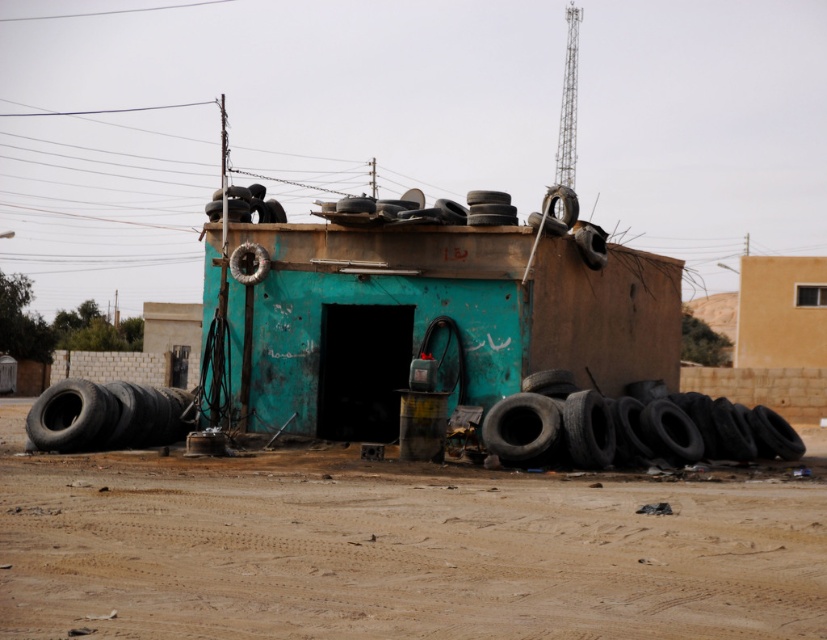
Who is taller, teal matte hut at center or beige stucco wall at upper right?

With more height is teal matte hut at center.

Is teal matte hut at center positioned before beige stucco wall at upper right?

Yes, it is in front of beige stucco wall at upper right.

Based on the photo, who is more forward, (366, 291) or (756, 346)?

Point (366, 291)

Find the location of a particular element. The image size is (827, 640). teal matte hut at center is located at coordinates (429, 316).

Who is taller, rubber tire at upper center or black rubber tire at upper right?

black rubber tire at upper right is taller.

Is rubber tire at upper center thinner than black rubber tire at upper right?

Indeed, rubber tire at upper center has a lesser width compared to black rubber tire at upper right.

Identify the location of rubber tire at upper center. (252, 204).

Which of these two, teal matte hut at center or black rubber tire at upper right, stands taller?

black rubber tire at upper right is taller.

Between teal matte hut at center and black rubber tire at upper right, which one appears on the left side from the viewer's perspective?

Positioned to the left is teal matte hut at center.

The width and height of the screenshot is (827, 640). In order to click on teal matte hut at center in this screenshot , I will do `click(429, 316)`.

The width and height of the screenshot is (827, 640). What are the coordinates of `teal matte hut at center` in the screenshot? It's located at (429, 316).